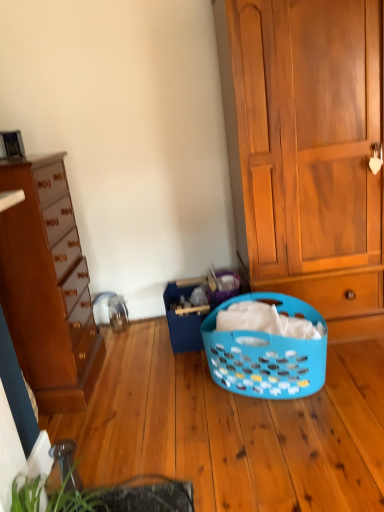
Question: From the image's perspective, is green leafy plant at lower left under blue plastic laundry basket at center?

Choices:
 (A) yes
 (B) no

Answer: (A)

Question: Is there a large distance between green leafy plant at lower left and blue plastic laundry basket at center?

Choices:
 (A) no
 (B) yes

Answer: (B)

Question: Is green leafy plant at lower left at the right side of blue plastic laundry basket at center?

Choices:
 (A) yes
 (B) no

Answer: (B)

Question: Is green leafy plant at lower left bigger than blue plastic laundry basket at center?

Choices:
 (A) no
 (B) yes

Answer: (A)

Question: Is green leafy plant at lower left thinner than blue plastic laundry basket at center?

Choices:
 (A) no
 (B) yes

Answer: (A)

Question: Considering the relative positions of green leafy plant at lower left and blue plastic laundry basket at center in the image provided, is green leafy plant at lower left behind blue plastic laundry basket at center?

Choices:
 (A) yes
 (B) no

Answer: (B)

Question: From a real-world perspective, does wooden cabinet at right, which is counted as the 1th cabinetry, starting from the right, sit lower than matte brown dresser at left, the 1th cabinetry viewed from the left?

Choices:
 (A) no
 (B) yes

Answer: (A)

Question: Does wooden cabinet at right, which is counted as the 1th cabinetry, starting from the right, appear on the left side of matte brown dresser at left, the 1th cabinetry viewed from the left?

Choices:
 (A) no
 (B) yes

Answer: (A)

Question: Can you see wooden cabinet at right, arranged as the 2th cabinetry when viewed from the left, touching matte brown dresser at left, the 1th cabinetry viewed from the left?

Choices:
 (A) yes
 (B) no

Answer: (B)

Question: Does wooden cabinet at right, arranged as the 2th cabinetry when viewed from the left, have a greater width compared to matte brown dresser at left, the 2th cabinetry viewed from the right?

Choices:
 (A) no
 (B) yes

Answer: (B)

Question: Is wooden cabinet at right, which is counted as the 1th cabinetry, starting from the right, positioned with its back to matte brown dresser at left, the 2th cabinetry viewed from the right?

Choices:
 (A) yes
 (B) no

Answer: (B)

Question: Is wooden cabinet at right, arranged as the 2th cabinetry when viewed from the left, bigger than matte brown dresser at left, the 1th cabinetry viewed from the left?

Choices:
 (A) no
 (B) yes

Answer: (B)

Question: From the image's perspective, is blue plastic laundry basket at center located above wooden cabinet at right, arranged as the 2th cabinetry when viewed from the left?

Choices:
 (A) no
 (B) yes

Answer: (A)